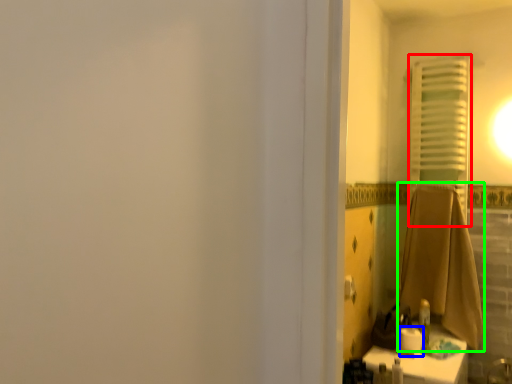
Question: Considering the real-world distances, which object is farthest from curtain (highlighted by a red box)? toilet paper (highlighted by a blue box) or bath towel (highlighted by a green box)?

Choices:
 (A) toilet paper
 (B) bath towel

Answer: (A)